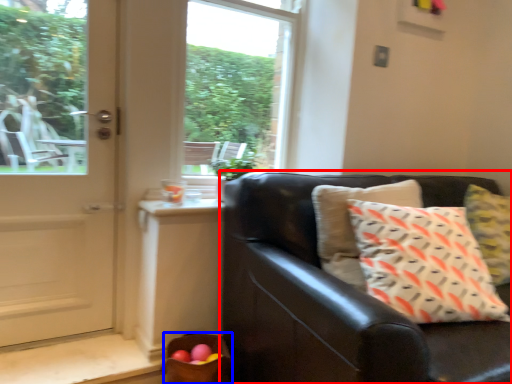
Question: Which object appears farthest to the camera in this image, studio couch (highlighted by a red box) or basket (highlighted by a blue box)?

Choices:
 (A) studio couch
 (B) basket

Answer: (B)